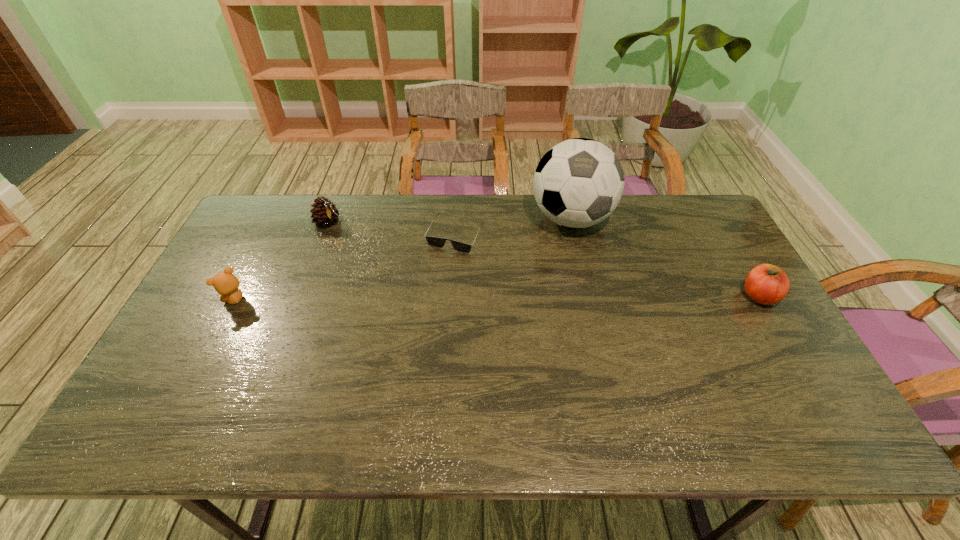
Image resolution: width=960 pixels, height=540 pixels. Find the location of `unoccupied area between the teddy bear and the rightmost object`. unoccupied area between the teddy bear and the rightmost object is located at coordinates (497, 298).

The height and width of the screenshot is (540, 960). I want to click on free area in between the leftmost object and the third object from right to left, so click(x=346, y=268).

Where is `free spot between the apple and the tallest object`? free spot between the apple and the tallest object is located at coordinates (665, 258).

At what (x,y) coordinates should I click in order to perform the action: click on vacant space that's between the teddy bear and the fourth object from right to left. Please return your answer as a coordinate pair (x, y). Image resolution: width=960 pixels, height=540 pixels. Looking at the image, I should click on (282, 261).

Find the location of a particular element. This screenshot has height=540, width=960. free spot between the second object from left to right and the shortest object is located at coordinates (393, 229).

Locate an element on the screen. This screenshot has width=960, height=540. empty space that is in between the third object from right to left and the second object from left to right is located at coordinates (393, 229).

Find the location of a particular element. This screenshot has height=540, width=960. vacant space that's between the teddy bear and the sunglasses is located at coordinates (346, 268).

Where is `vacant space in between the apple and the sunglasses`? The width and height of the screenshot is (960, 540). vacant space in between the apple and the sunglasses is located at coordinates (608, 266).

Identify the location of the third closest object to the second object from right to left. (x=325, y=213).

Image resolution: width=960 pixels, height=540 pixels. What are the coordinates of `object that can be found as the closest to the soccer ball` in the screenshot? It's located at (436, 242).